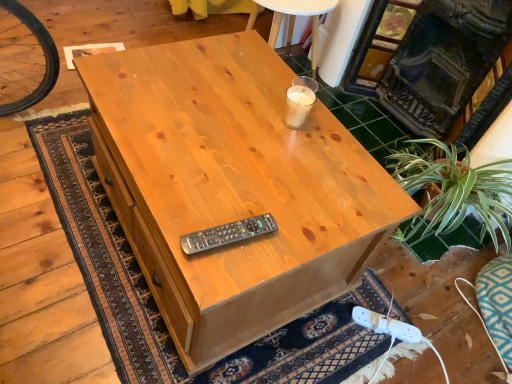
Question: Does white plastic plug at lower right have a greater width compared to black plastic remote at center?

Choices:
 (A) yes
 (B) no

Answer: (A)

Question: From a real-world perspective, is white plastic plug at lower right located beneath black plastic remote at center?

Choices:
 (A) yes
 (B) no

Answer: (A)

Question: Considering the relative sizes of white plastic plug at lower right and black plastic remote at center in the image provided, is white plastic plug at lower right taller than black plastic remote at center?

Choices:
 (A) yes
 (B) no

Answer: (B)

Question: Considering the relative sizes of white plastic plug at lower right and black plastic remote at center in the image provided, is white plastic plug at lower right thinner than black plastic remote at center?

Choices:
 (A) no
 (B) yes

Answer: (A)

Question: From the image's perspective, is white plastic plug at lower right above black plastic remote at center?

Choices:
 (A) no
 (B) yes

Answer: (A)

Question: Is white plastic plug at lower right not inside black plastic remote at center?

Choices:
 (A) yes
 (B) no

Answer: (A)

Question: Can you confirm if dark gray stone fireplace at upper right is shorter than natural wood desk at center?

Choices:
 (A) no
 (B) yes

Answer: (A)

Question: Considering the relative sizes of dark gray stone fireplace at upper right and natural wood desk at center in the image provided, is dark gray stone fireplace at upper right thinner than natural wood desk at center?

Choices:
 (A) no
 (B) yes

Answer: (B)

Question: Is dark gray stone fireplace at upper right bigger than natural wood desk at center?

Choices:
 (A) no
 (B) yes

Answer: (A)

Question: Is dark gray stone fireplace at upper right at the right side of natural wood desk at center?

Choices:
 (A) yes
 (B) no

Answer: (A)

Question: Is dark gray stone fireplace at upper right oriented away from natural wood desk at center?

Choices:
 (A) yes
 (B) no

Answer: (B)

Question: From a real-world perspective, is dark gray stone fireplace at upper right positioned over natural wood desk at center based on gravity?

Choices:
 (A) yes
 (B) no

Answer: (A)

Question: From the image's perspective, is white plastic plug at lower right on top of natural wood desk at center?

Choices:
 (A) no
 (B) yes

Answer: (A)